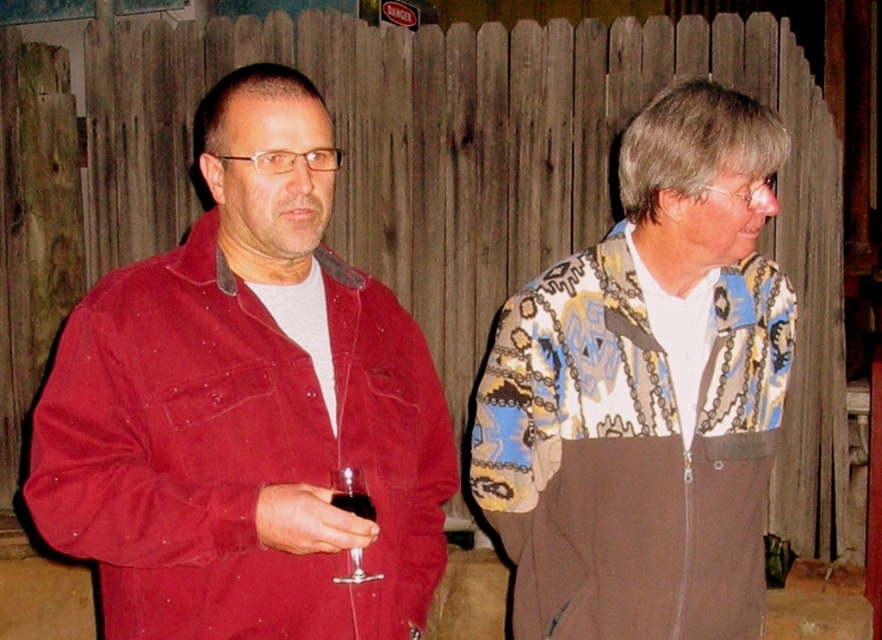
From the picture: You are a photographer trying to capture both the printed fabric jacket at right and the transparent glass at lower left in a single frame. Given their sizes, which object will appear bigger in the photo?

The printed fabric jacket at right will appear bigger in the photo because it is larger in size than the transparent glass at lower left.

You are a photographer setting up a tripod between the matte red jacket at left and the printed fabric jacket at right. The tripod requires a minimum of 1 meter of space between the two jackets to fit. Can you determine if there is enough space based on their sizes?

The matte red jacket at left is larger in size than the printed fabric jacket at right, but the exact distance between them isn